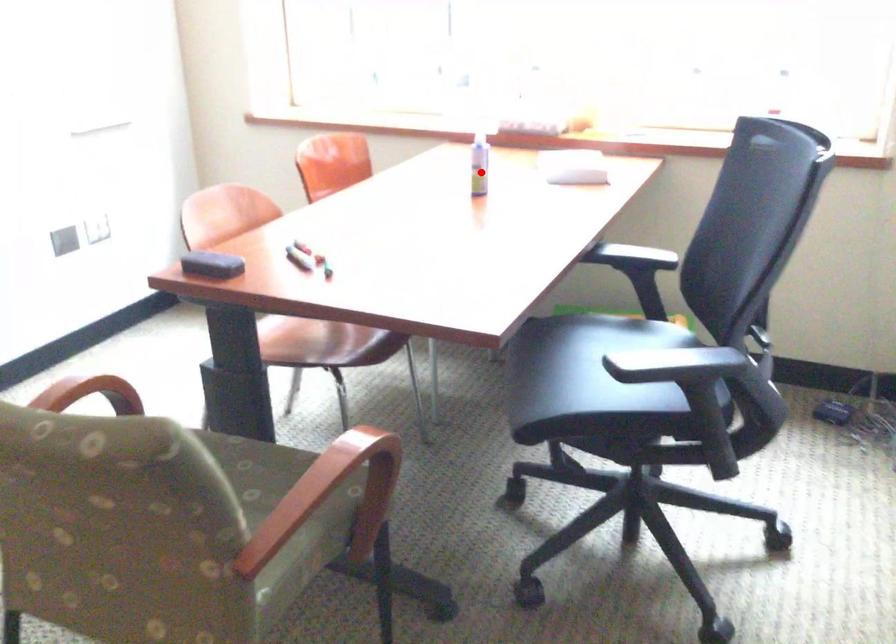
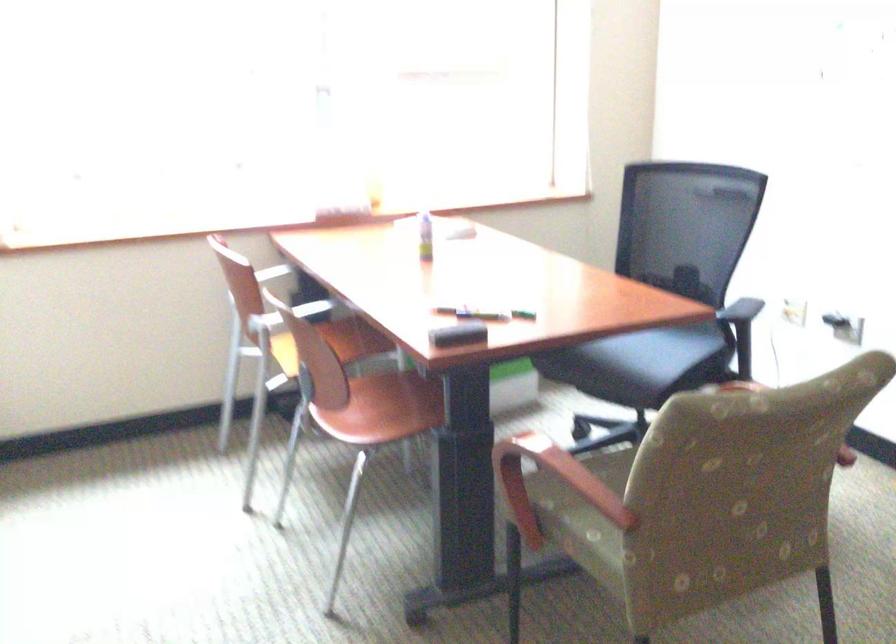
Where in the second image is the point corresponding to the highlighted location from the first image?

(425, 236)